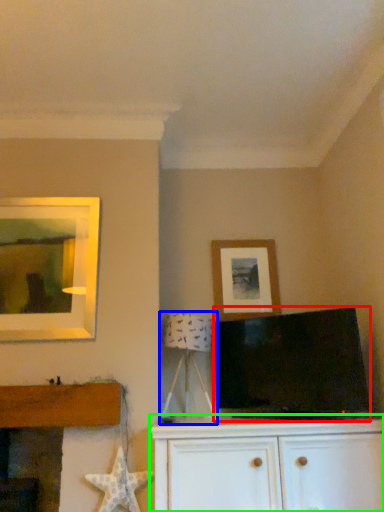
Question: Which object is the farthest from television (highlighted by a red box)? Choose among these: table lamp (highlighted by a blue box) or cabinetry (highlighted by a green box).

Choices:
 (A) table lamp
 (B) cabinetry

Answer: (A)